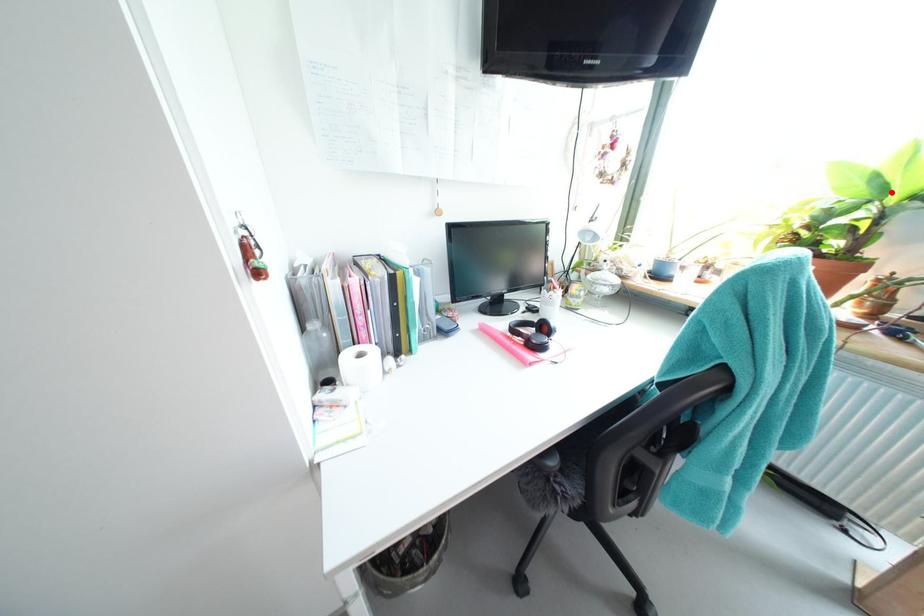
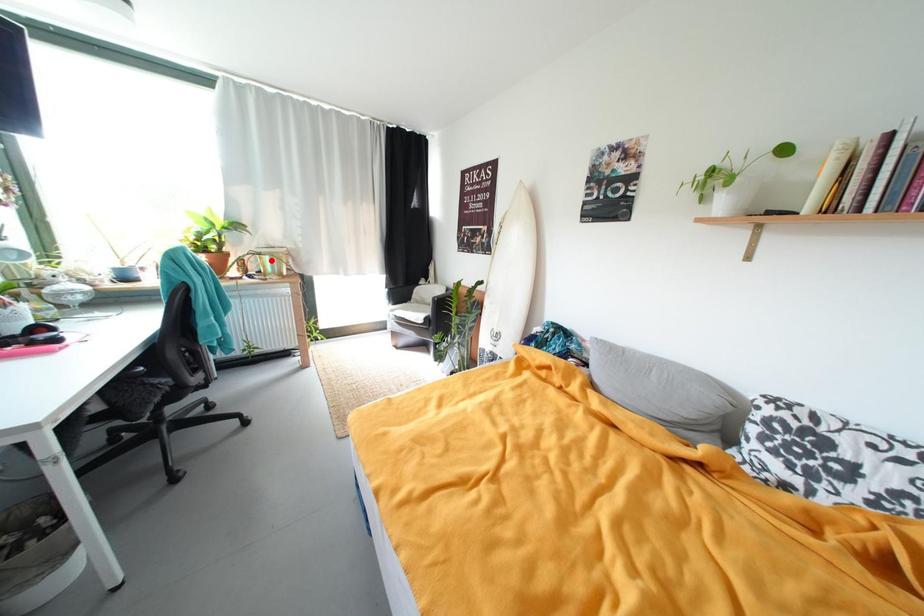
I am providing you with two images of the same scene from different viewpoints. A red point is marked on the first image and another point is marked on the second image. Are the points marked in image1 and image2 representing the same 3D position?

No